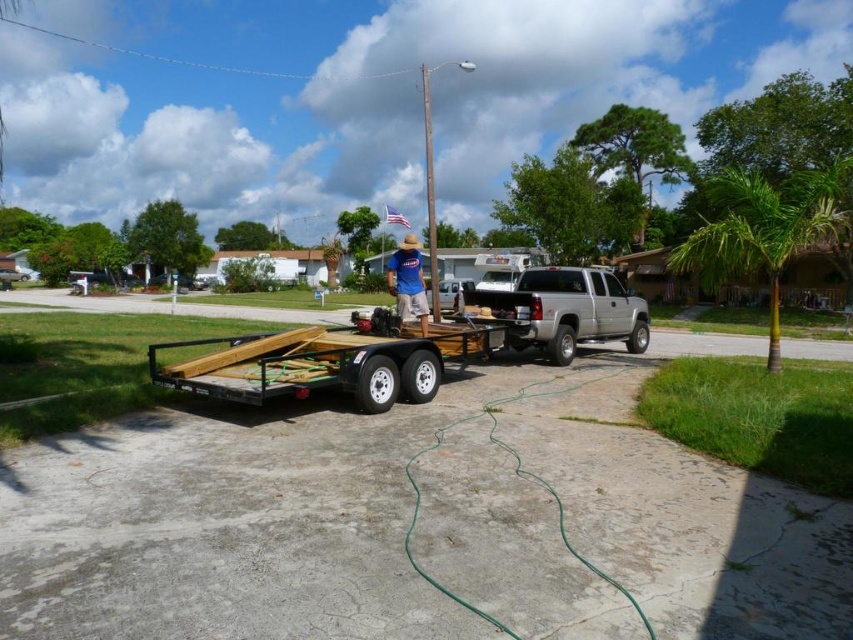
You are planning to load a large piece of equipment that is 2 meters wide onto the metallic silver trailer at center. Considering the width of the trailer, can the equipment fit? Please refer to the blue cotton shirt at center for size comparison.

The metallic silver trailer at center has a lesser width compared to the blue cotton shirt at center. Since the equipment is 2 meters wide, if the blue cotton shirt at center is wider than 2 meters, the trailer might be narrower and unable to accommodate the equipment. However, without knowing the shirt width, we cannot definitively answer. Please provide the shirt width for accurate assessment.

You are standing at point A located at coordinates point A at (305, 372). You need to walk to point B, which is 25.36 feet away. If your walking speed is 3 feet per second, how many seconds will it take you to reach point B?

The distance between point A at (305, 372) and point B is 25.36 feet. At a walking speed of 3 feet per second, it will take approximately 8.45 seconds to reach point B.

You are a delivery driver trying to attach a new trailer to your truck. You see two points marked on the ground, point (567,355) and point (419,296). Which point should you position your truck closer to ensure the hitch connects properly?

You should position your truck closer to point (419,296) because point (567,355) is behind it, meaning point (419,296) is the forward position for proper hitch alignment.